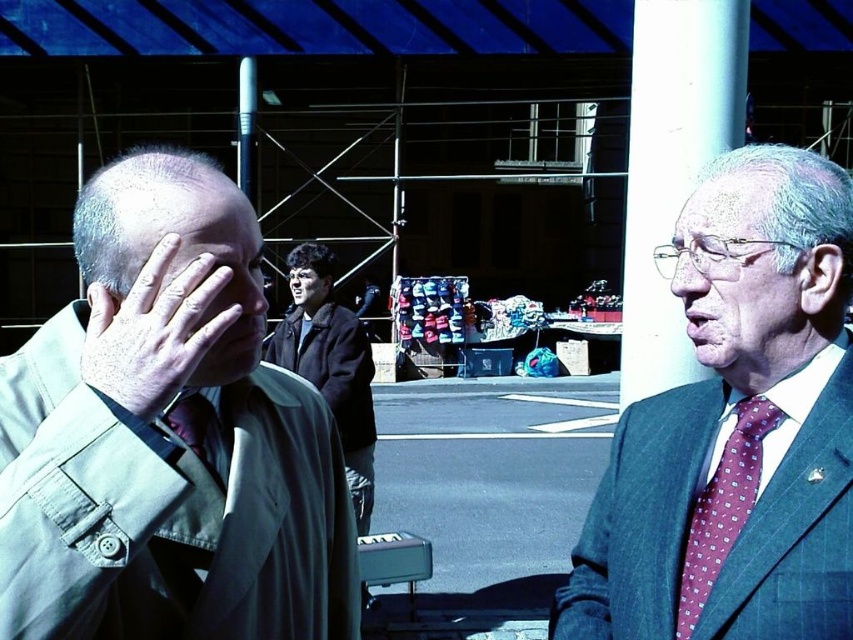
Measure the distance between gray textured suit at right and smooth skin face at center.

They are 4.13 meters apart.

Can you confirm if gray textured suit at right is positioned above smooth skin face at center?

No, gray textured suit at right is not above smooth skin face at center.

The width and height of the screenshot is (853, 640). I want to click on gray textured suit at right, so [x=738, y=282].

Which is below, dry skin hand at left or matte black nose at center?

dry skin hand at left is lower down.

Which is more to the right, dry skin hand at left or matte black nose at center?

Positioned to the right is dry skin hand at left.

Does point (163, 372) lie behind point (248, 298)?

No, it is in front of (248, 298).

You are a GUI agent. You are given a task and a screenshot of the screen. Output one action in this format:
    pyautogui.click(x=<x>, y=<y>)
    Task: Click on the dry skin hand at left
    The width and height of the screenshot is (853, 640).
    Given the screenshot: What is the action you would take?
    pyautogui.click(x=154, y=330)

Is khaki fabric jacket at left further to camera compared to gray textured suit at right?

No.

Is point (180, 637) more distant than point (682, 248)?

No.

You are a GUI agent. You are given a task and a screenshot of the screen. Output one action in this format:
    pyautogui.click(x=<x>, y=<y>)
    Task: Click on the khaki fabric jacket at left
    The image size is (853, 640).
    Given the screenshot: What is the action you would take?
    pyautogui.click(x=167, y=436)